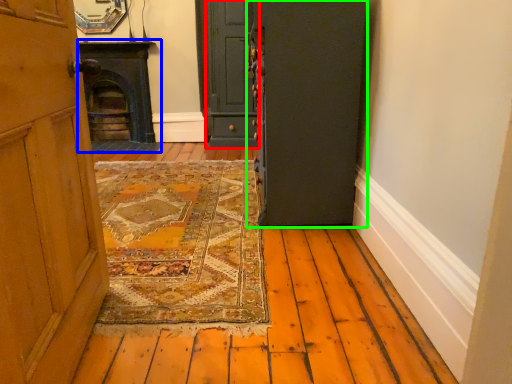
Question: Which object is the farthest from door (highlighted by a red box)? Choose among these: fireplace (highlighted by a blue box) or door (highlighted by a green box).

Choices:
 (A) fireplace
 (B) door

Answer: (B)